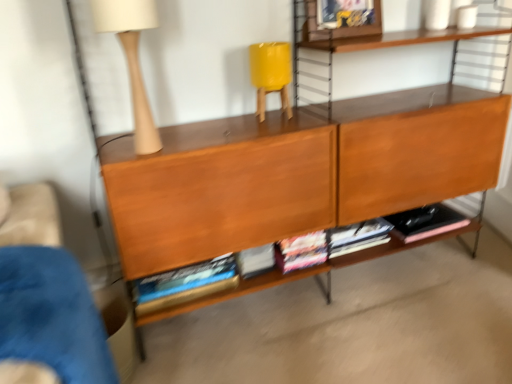
Question: Can you confirm if blue fabric armchair at lower left is taller than hardcover books at center?

Choices:
 (A) yes
 (B) no

Answer: (A)

Question: Can you confirm if blue fabric armchair at lower left is positioned to the left of hardcover books at center?

Choices:
 (A) yes
 (B) no

Answer: (A)

Question: Is blue fabric armchair at lower left wider than hardcover books at center?

Choices:
 (A) yes
 (B) no

Answer: (A)

Question: Does blue fabric armchair at lower left appear on the right side of hardcover books at center?

Choices:
 (A) yes
 (B) no

Answer: (B)

Question: Considering the relative sizes of blue fabric armchair at lower left and hardcover books at center in the image provided, is blue fabric armchair at lower left thinner than hardcover books at center?

Choices:
 (A) yes
 (B) no

Answer: (B)

Question: In the image, is blue fabric armchair at lower left on the left side or the right side of brown wood shelf at center?

Choices:
 (A) right
 (B) left

Answer: (B)

Question: Is blue fabric armchair at lower left in front of or behind brown wood shelf at center in the image?

Choices:
 (A) behind
 (B) front

Answer: (B)

Question: Would you say blue fabric armchair at lower left is inside or outside brown wood shelf at center?

Choices:
 (A) outside
 (B) inside

Answer: (A)

Question: From a real-world perspective, is blue fabric armchair at lower left positioned above or below brown wood shelf at center?

Choices:
 (A) above
 (B) below

Answer: (B)

Question: Which is correct: brown wood shelf at center is inside matte beige table lamp at upper left, or outside of it?

Choices:
 (A) outside
 (B) inside

Answer: (A)

Question: In terms of width, does brown wood shelf at center look wider or thinner when compared to matte beige table lamp at upper left?

Choices:
 (A) thin
 (B) wide

Answer: (B)

Question: Is brown wood shelf at center taller or shorter than matte beige table lamp at upper left?

Choices:
 (A) short
 (B) tall

Answer: (B)

Question: Would you say brown wood shelf at center is to the left or to the right of matte beige table lamp at upper left in the picture?

Choices:
 (A) right
 (B) left

Answer: (A)

Question: From a real-world perspective, is matte beige table lamp at upper left above or below blue fabric armchair at lower left?

Choices:
 (A) above
 (B) below

Answer: (A)

Question: From the image's perspective, relative to blue fabric armchair at lower left, is matte beige table lamp at upper left above or below?

Choices:
 (A) above
 (B) below

Answer: (A)